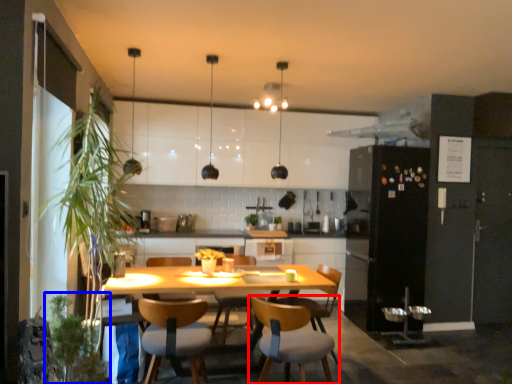
Question: Which object appears farthest to the camera in this image, chair (highlighted by a red box) or plant (highlighted by a blue box)?

Choices:
 (A) chair
 (B) plant

Answer: (A)